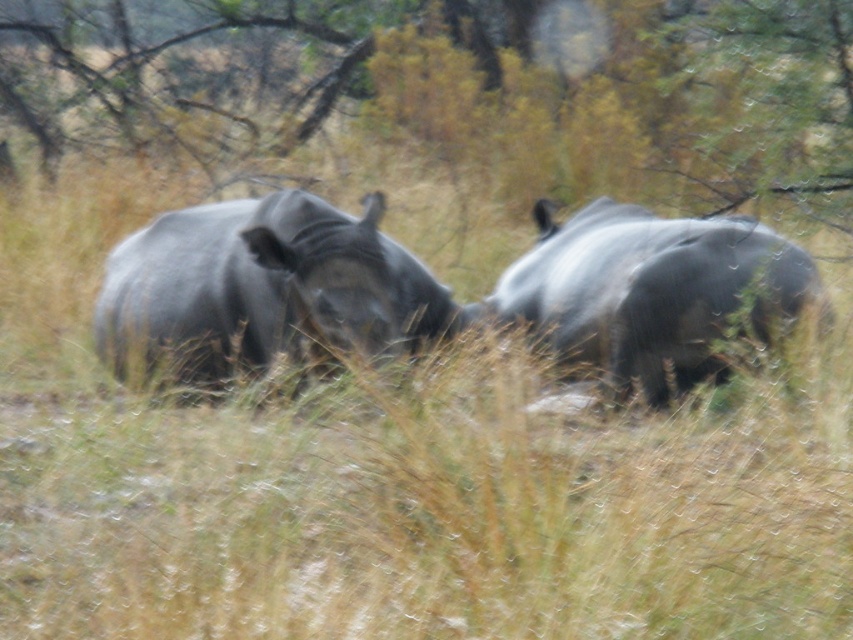
You are a photographer trying to capture a photo of the smooth gray rhino at center. You notice a brown textured tree at upper center in the background. Where should you position yourself relative to the rhino to ensure the tree isn not blocking the view?

To avoid the brown textured tree at upper center blocking the view, position yourself to the left side of the smooth gray rhino at center since the tree is on the rhino s right side.

You are a wildlife photographer trying to capture both the smooth gray rhino at center and the gray matte rhinoceros at right in a single frame. Given their sizes, which rhino will appear smaller in the photo?

The smooth gray rhino at center occupies less space than the gray matte rhinoceros at right, so it will appear smaller in the photo.

You are a photographer trying to capture a photo of the smooth gray rhino at center. You notice a brown textured tree at upper center in your frame. Based on their sizes, will the tree block the rhino in your photo?

The brown textured tree at upper center is taller than the smooth gray rhino at center, so the tree may block part of the rhino in the photo depending on their positions and the camera angle.